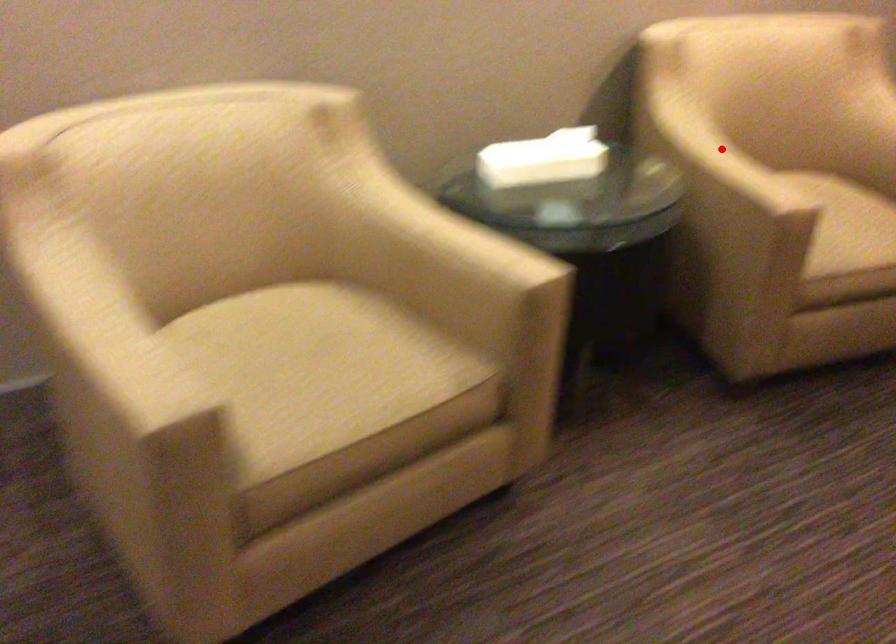
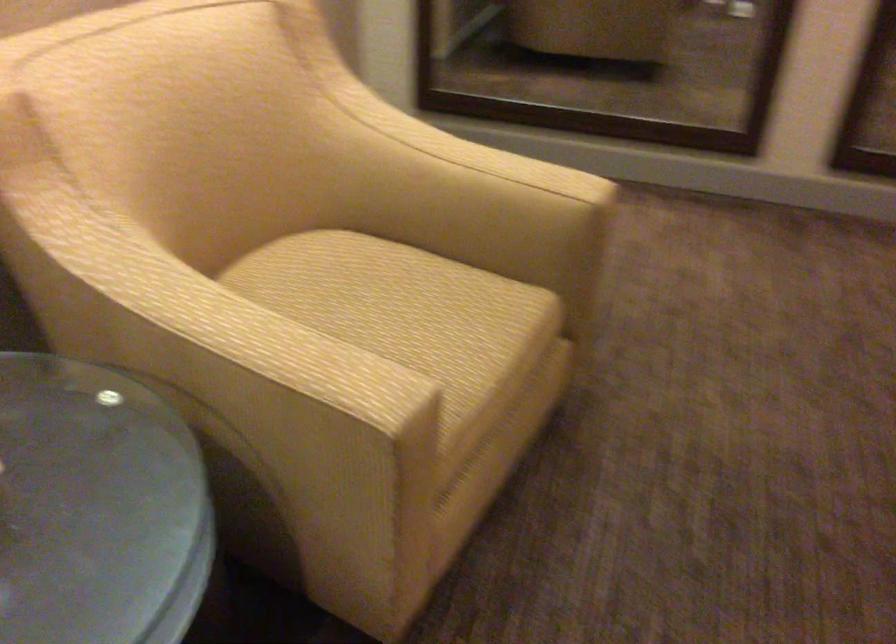
Question: I am providing you with two images of the same scene from different viewpoints. Image1 has a red point marked. In image2, the corresponding 3D location appears at what relative position? Reply with the corresponding letter.

Choices:
 (A) Closer
 (B) Farther

Answer: (A)